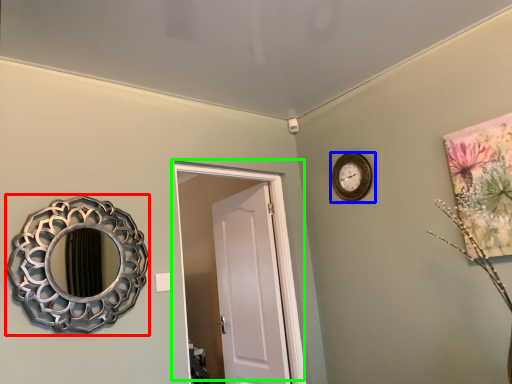
Question: Based on their relative distances, which object is farther from mirror (highlighted by a red box)? Choose from wall clock (highlighted by a blue box) and door (highlighted by a green box).

Choices:
 (A) wall clock
 (B) door

Answer: (A)